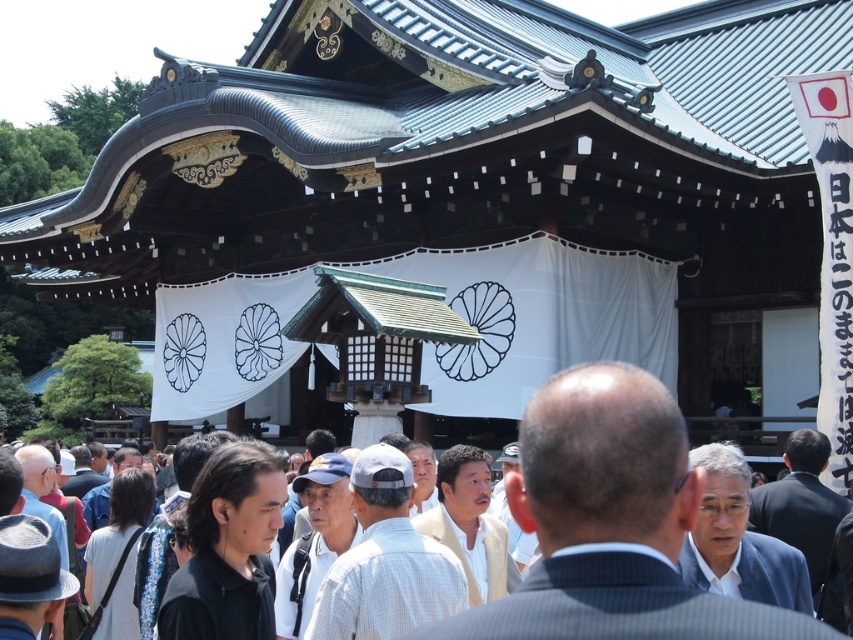
Can you confirm if black matte hair at center is bigger than light gray fabric bag at lower left?

Actually, black matte hair at center might be smaller than light gray fabric bag at lower left.

Does black matte hair at center appear over light gray fabric bag at lower left?

Correct, black matte hair at center is located above light gray fabric bag at lower left.

Locate an element on the screen. The width and height of the screenshot is (853, 640). black matte hair at center is located at coordinates (228, 548).

Where is `black matte hair at center`? The image size is (853, 640). black matte hair at center is located at coordinates (228, 548).